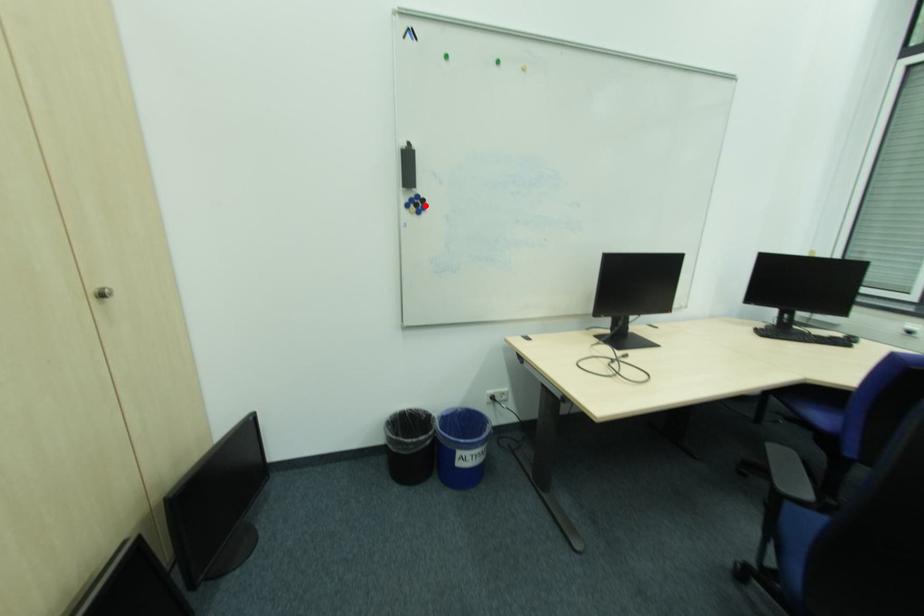
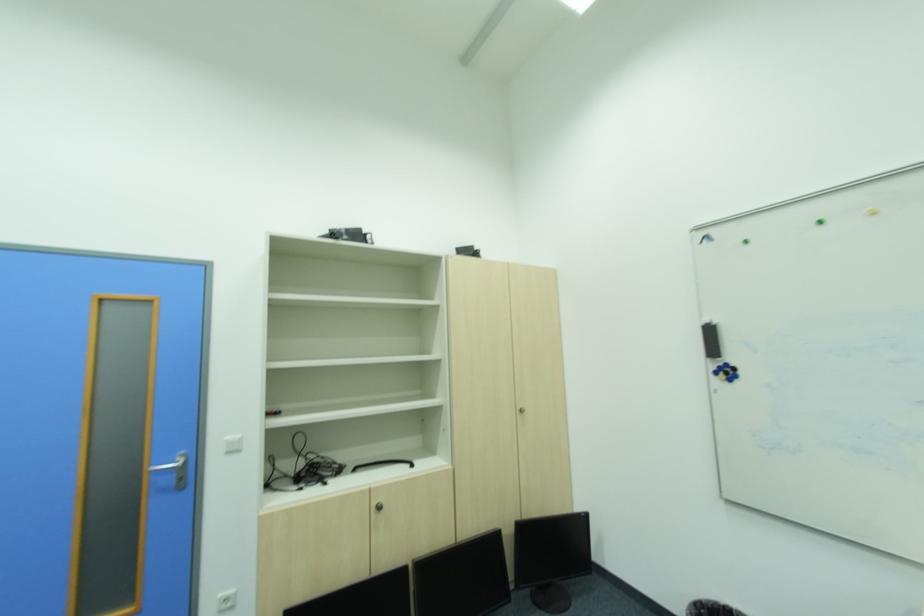
Locate, in the second image, the point that corresponds to the highlighted location in the first image.

(736, 371)